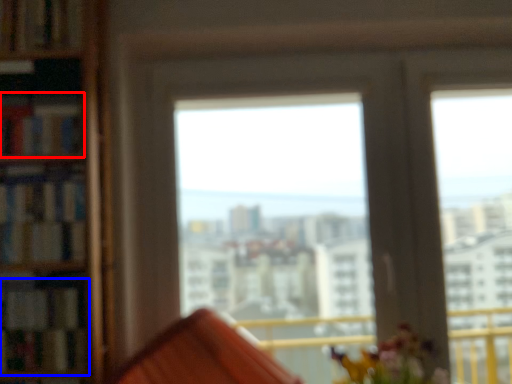
Question: Which object is further to the camera taking this photo, book (highlighted by a red box) or book (highlighted by a blue box)?

Choices:
 (A) book
 (B) book

Answer: (A)